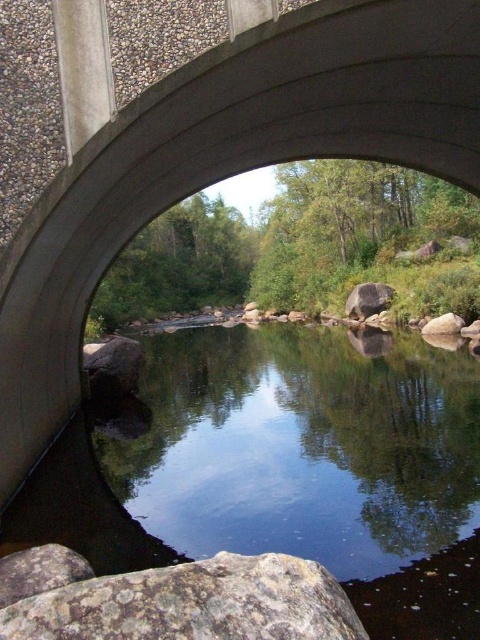
Question: Among these objects, which one is nearest to the camera?

Choices:
 (A) gray rough rock at center
 (B) smooth gray rock at lower right

Answer: (B)

Question: Is clear water at center to the left of smooth gray rock at right from the viewer's perspective?

Choices:
 (A) no
 (B) yes

Answer: (B)

Question: Which of the following is the closest to the observer?

Choices:
 (A) gray rough rock at center
 (B) clear water at center

Answer: (B)

Question: Is rusty metallic rock at lower left thinner than gray rough rock at lower left?

Choices:
 (A) yes
 (B) no

Answer: (A)

Question: Is rusty metallic rock at lower left behind smooth gray rock at lower right?

Choices:
 (A) yes
 (B) no

Answer: (B)

Question: Which object is positioned farthest from the rusty rock at lower left?

Choices:
 (A) gray rough rock at center
 (B) smooth gray rock at right

Answer: (A)